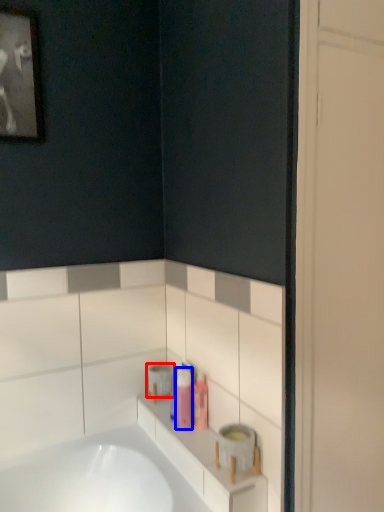
Question: Which of the following is the farthest to the observer, toilet paper (highlighted by a red box) or toiletry (highlighted by a blue box)?

Choices:
 (A) toilet paper
 (B) toiletry

Answer: (A)